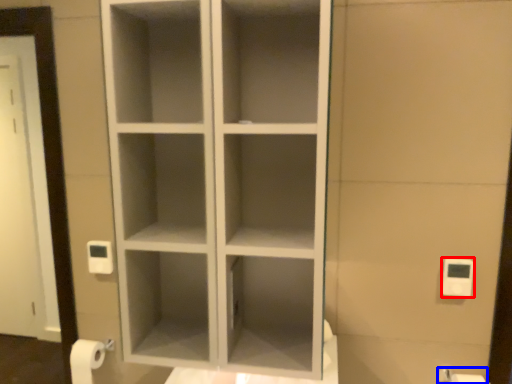
Question: Which of the following is the closest to the observer, light switch (highlighted by a red box) or toilet paper (highlighted by a blue box)?

Choices:
 (A) light switch
 (B) toilet paper

Answer: (B)